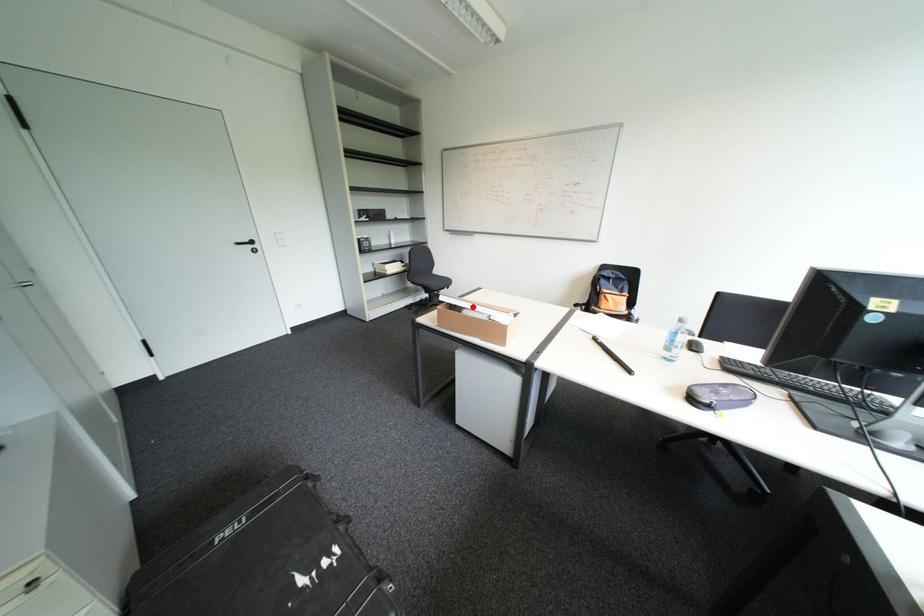
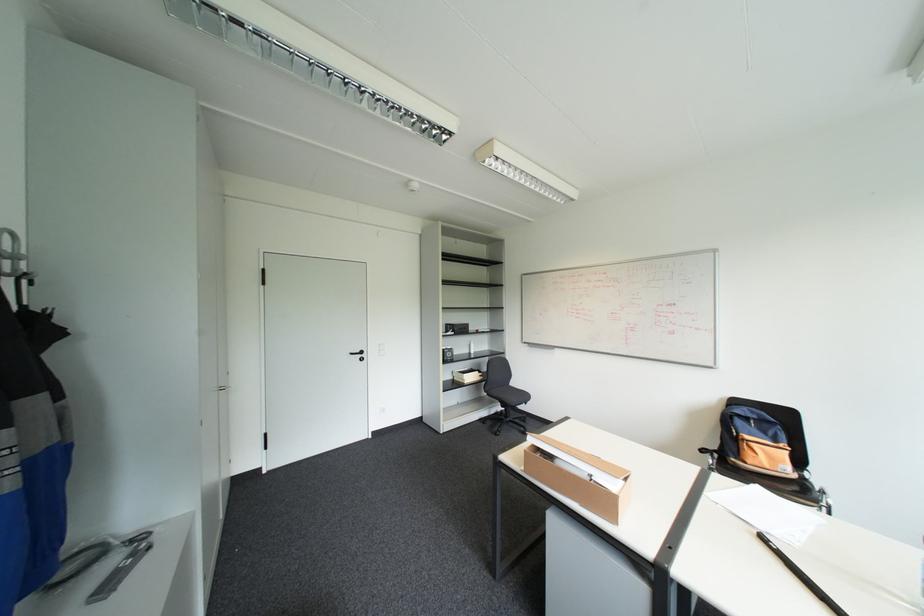
Find the pixel in the second image that matches the highlighted location in the first image.

(565, 455)